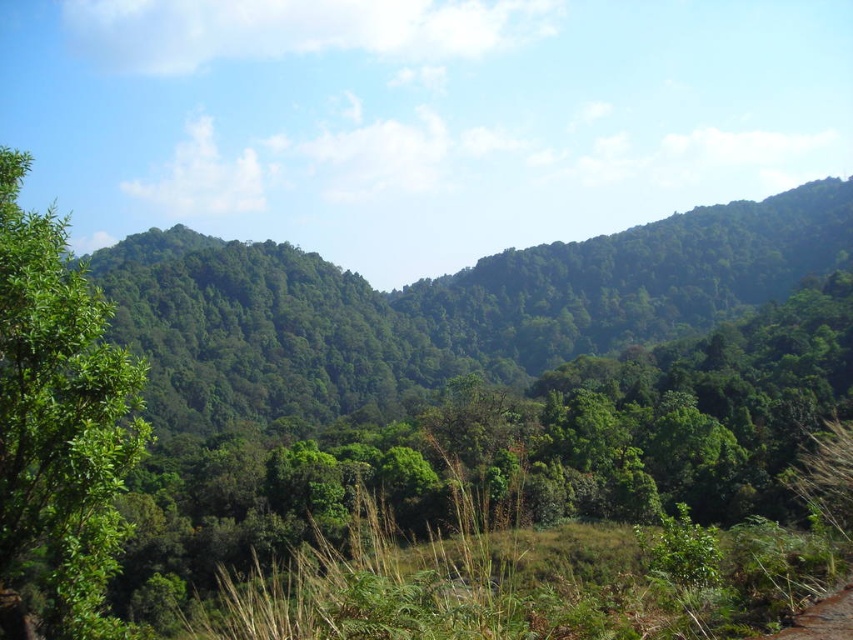
In the scene shown: Between green leafy forest at center and green leafy tree at left, which one appears on the left side from the viewer's perspective?

From the viewer's perspective, green leafy tree at left appears more on the left side.

Can you confirm if green leafy forest at center is positioned to the right of green leafy tree at left?

Correct, you'll find green leafy forest at center to the right of green leafy tree at left.

The image size is (853, 640). I want to click on green leafy forest at center, so click(440, 307).